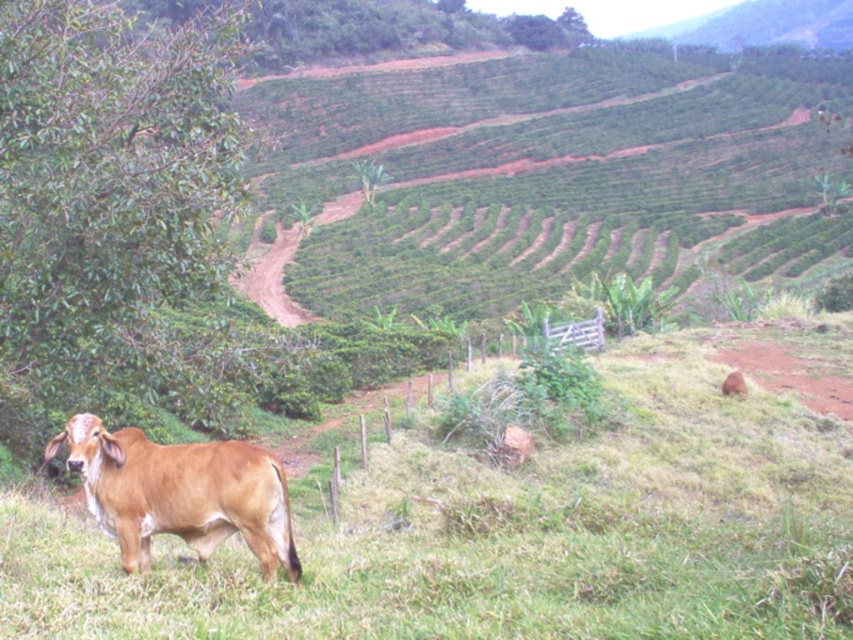
Looking at this image, you are standing in the rural landscape looking at the terraced fields and the cow. There are two points marked in the image. Which point, point (648, 481) or point (131, 448), is closer to you?

Point (648, 481) is further to the viewer than point (131, 448), so the closer point to you is point (131, 448).